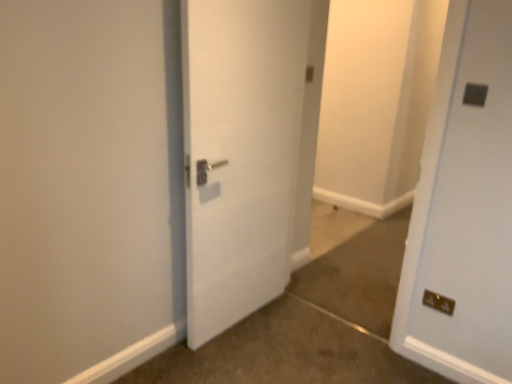
This screenshot has width=512, height=384. I want to click on empty space that is ontop of brown carpet at lower right (from a real-world perspective), so click(295, 349).